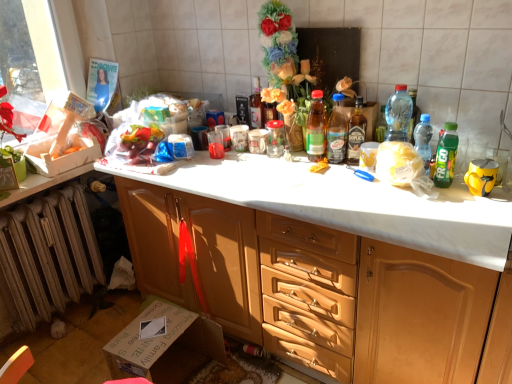
This screenshot has height=384, width=512. What are the coordinates of `vacant region in front of translucent plastic bottle at center, which is the 5th bottle from right to left` in the screenshot? It's located at (333, 173).